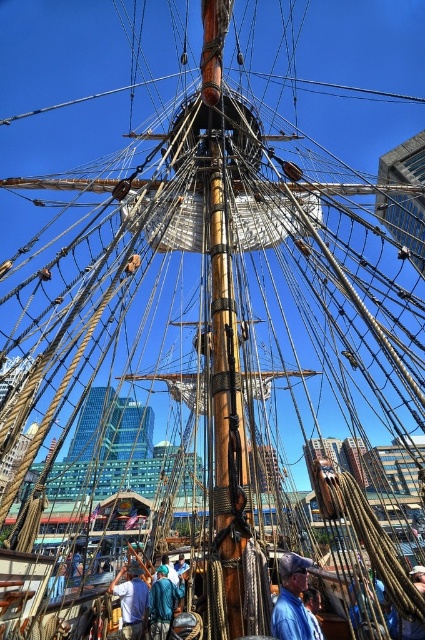
You are a photographer aiming to capture both the blue denim shirt at center and the white cotton shirt at center in a single shot. Since both are at the center, which one is positioned higher in the frame?

The blue denim shirt at center is located above the white cotton shirt at center, so it is positioned higher in the frame.

You are a photographer standing on the deck of the ship and want to take a photo of the blue denim shirt at center. Your camera is in your bag, which is located 50 meters away from you. Can you reach the camera in time to take the photo before the ship moves? Assume you can run at 5 meters per second and the ship will start moving in 10 seconds.

The blue denim shirt at center and camera are 50.95 meters apart from each other. Since you can run at 5 meters per second, it would take approximately 10.19 seconds to reach the camera. However, the ship will start moving in 10 seconds, so you won t make it in time.

You are a photographer who wants to capture both the white cotton shirt at center and the blue fabric shirt at center in a single shot. Since the camera can only focus on one shirt at a time, which shirt should you choose to ensure the other remains in the background? Explain your reasoning based on their sizes.

The white cotton shirt at center is larger than the blue fabric shirt at center. To keep the smaller blue fabric shirt at center in the background while focusing on the larger white cotton shirt at center, you should focus on the white cotton shirt at center. This way, the blue fabric shirt at center will naturally appear smaller and recede into the background.